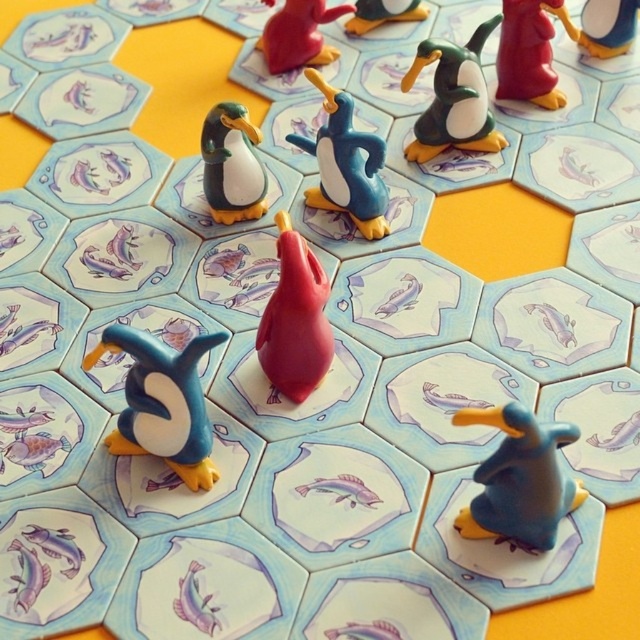
Is blue glossy penguin at center closer to camera compared to shiny plastic penguin at upper right?

Yes, it is.

Is blue glossy penguin at center to the left of shiny plastic penguin at upper right from the viewer's perspective?

Indeed, blue glossy penguin at center is positioned on the left side of shiny plastic penguin at upper right.

Does point (333, 148) lie in front of point (627, 40)?

Yes.

You are a GUI agent. You are given a task and a screenshot of the screen. Output one action in this format:
    pyautogui.click(x=<x>, y=<y>)
    Task: Click on the blue glossy penguin at center
    The width and height of the screenshot is (640, 640).
    Given the screenshot: What is the action you would take?
    pyautogui.click(x=346, y=164)

Is matte red penguin at upper right closer to the viewer compared to matte blue penguin at upper center?

Yes, matte red penguin at upper right is in front of matte blue penguin at upper center.

Who is more forward, (547, 8) or (388, 8)?

Point (547, 8)

The height and width of the screenshot is (640, 640). I want to click on matte red penguin at upper right, so click(529, 52).

Between blue plastic penguin at lower left and blue glossy penguin at center, which one has less height?

With less height is blue plastic penguin at lower left.

In the scene shown: Which is more to the left, blue plastic penguin at lower left or blue glossy penguin at center?

Positioned to the left is blue plastic penguin at lower left.

Who is more forward, [154,339] or [324,134]?

Point [154,339] is more forward.

Identify the location of blue plastic penguin at lower left. This screenshot has width=640, height=640. [163, 401].